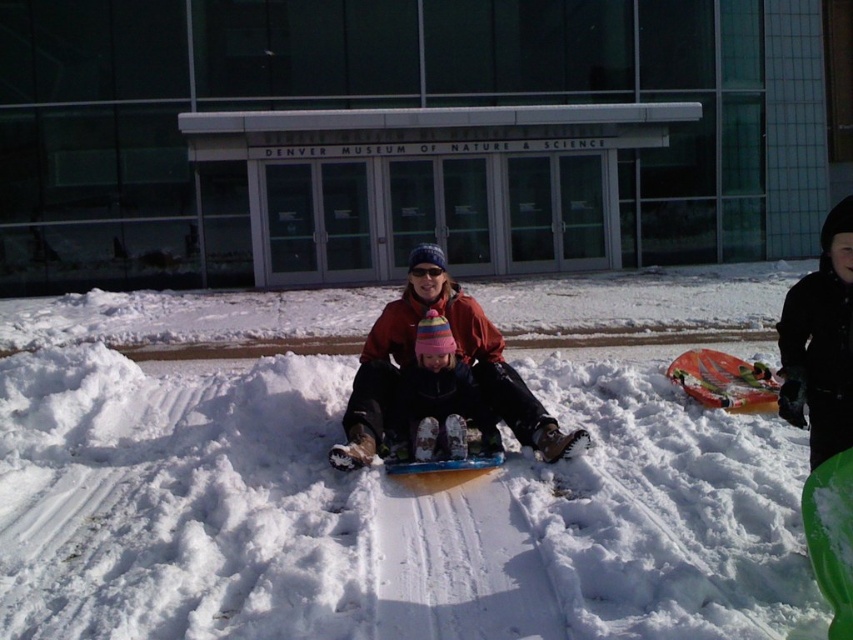
Question: Is white fluffy snow at center wider than green plastic snowboard at lower right?

Choices:
 (A) yes
 (B) no

Answer: (A)

Question: From the image, what is the correct spatial relationship of green plastic snowboard at lower right in relation to orange plastic snowboard at center?

Choices:
 (A) right
 (B) left

Answer: (B)

Question: Is matte red snowboard at center to the left of orange plastic snowboard at center from the viewer's perspective?

Choices:
 (A) no
 (B) yes

Answer: (B)

Question: Which point appears farthest from the camera in this image?

Choices:
 (A) (816, 515)
 (B) (395, 406)
 (C) (514, 355)
 (D) (416, 333)

Answer: (C)

Question: Which object is closer to the camera taking this photo?

Choices:
 (A) white fluffy snow at center
 (B) matte red snowboard at center
 (C) matte pink snowsuit at center

Answer: (A)

Question: Which object is the closest to the white fluffy snow at center?

Choices:
 (A) orange plastic snowboard at center
 (B) green plastic snowboard at lower right

Answer: (A)